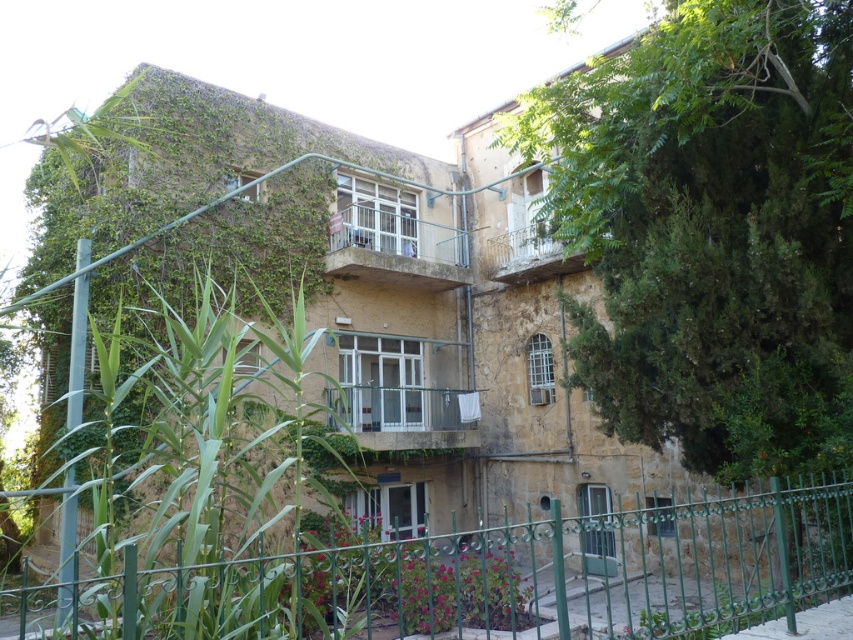
Question: Which point is closer to the camera?

Choices:
 (A) metallic white balcony at center
 (B) white wrought iron balcony at upper center

Answer: (B)

Question: Among these objects, which one is farthest from the camera?

Choices:
 (A) white wrought iron balcony at upper center
 (B) green metal fence at lower center
 (C) metallic white balcony at center

Answer: (C)

Question: Is metallic white balcony at center above white wrought iron balcony at upper center?

Choices:
 (A) no
 (B) yes

Answer: (B)

Question: Which of these objects is positioned closest to the metallic white balcony at center?

Choices:
 (A) green metal fence at lower center
 (B) white wrought iron balcony at upper center

Answer: (B)

Question: Where is green metal fence at lower center located in relation to metallic white balcony at center in the image?

Choices:
 (A) above
 (B) below

Answer: (B)

Question: In this image, where is green metal fence at lower center located relative to metallic white balcony at center?

Choices:
 (A) below
 (B) above

Answer: (A)